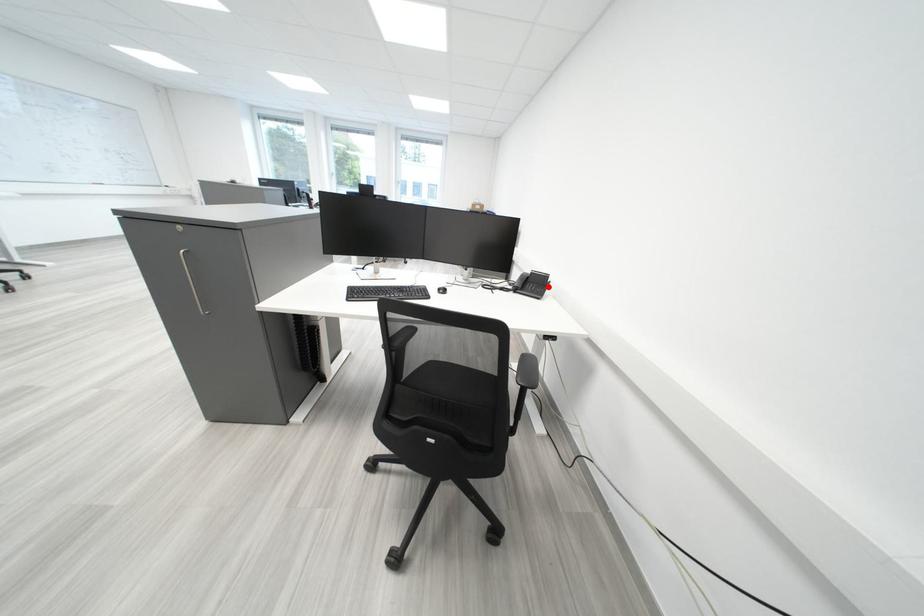
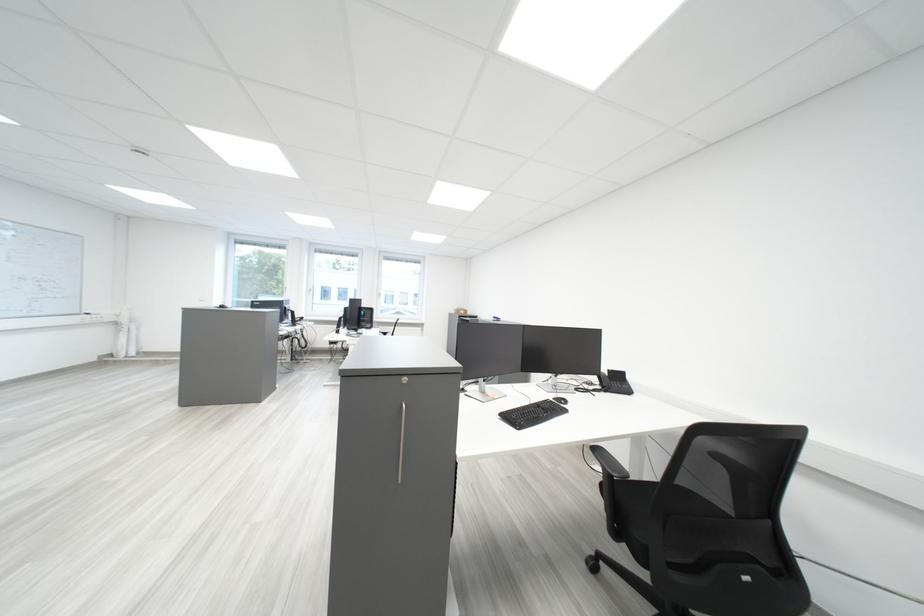
The point at the highlighted location is marked in the first image. Where is the corresponding point in the second image?

(629, 384)